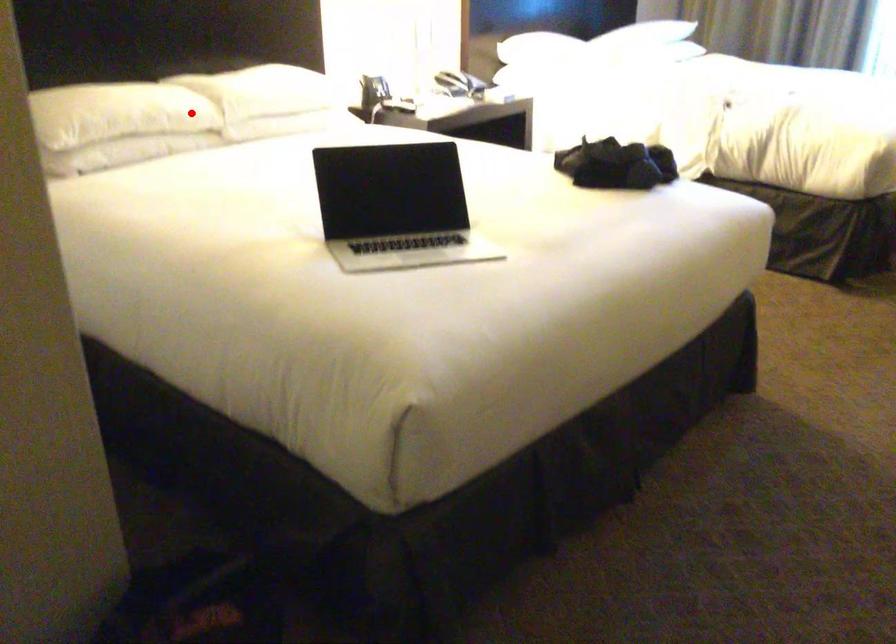
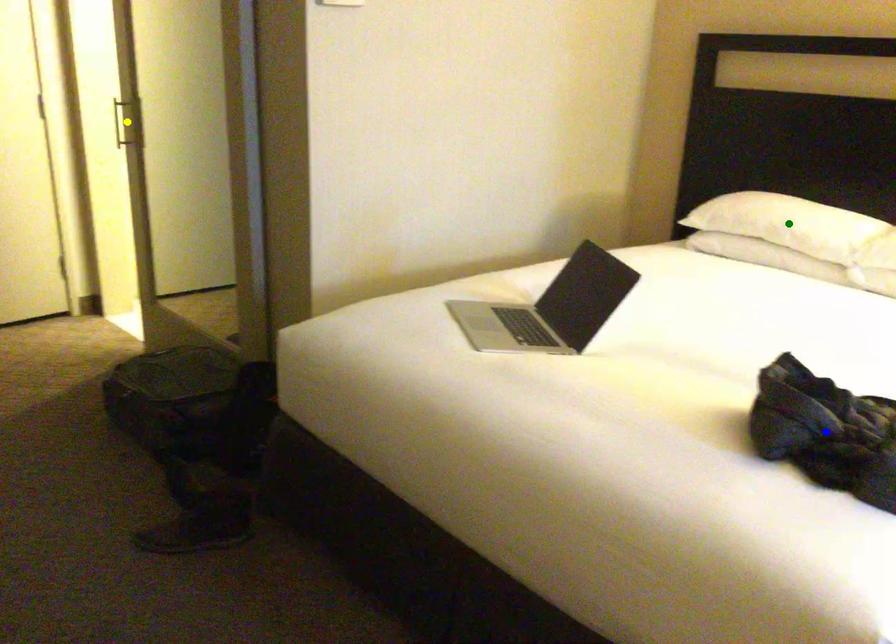
Question: I am providing you with two images of the same scene from different viewpoints. A red point is marked on the first image. You are given multiple points on the second image. Can you choose the point in image 2 that corresponds to the point in image 1?

Choices:
 (A) green point
 (B) blue point
 (C) yellow point

Answer: (A)